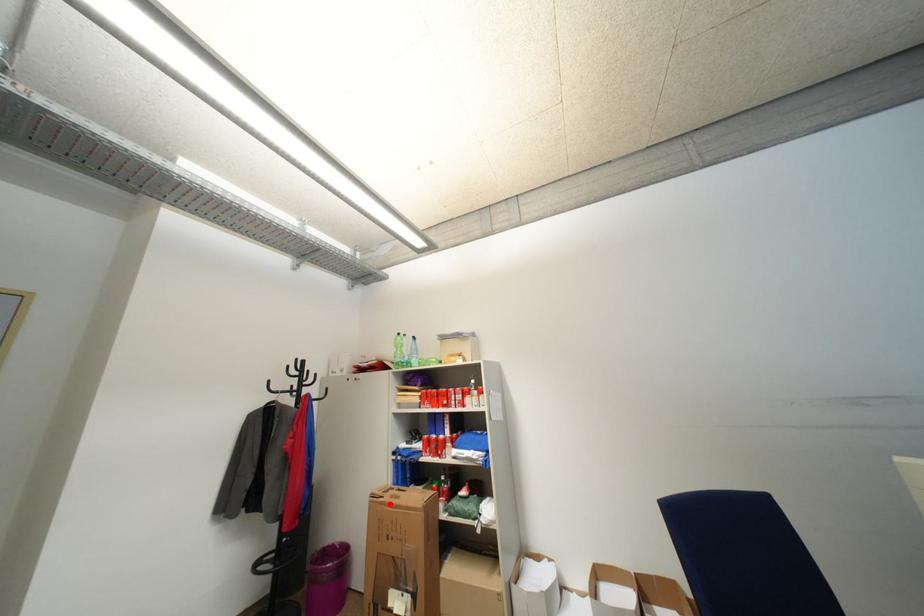
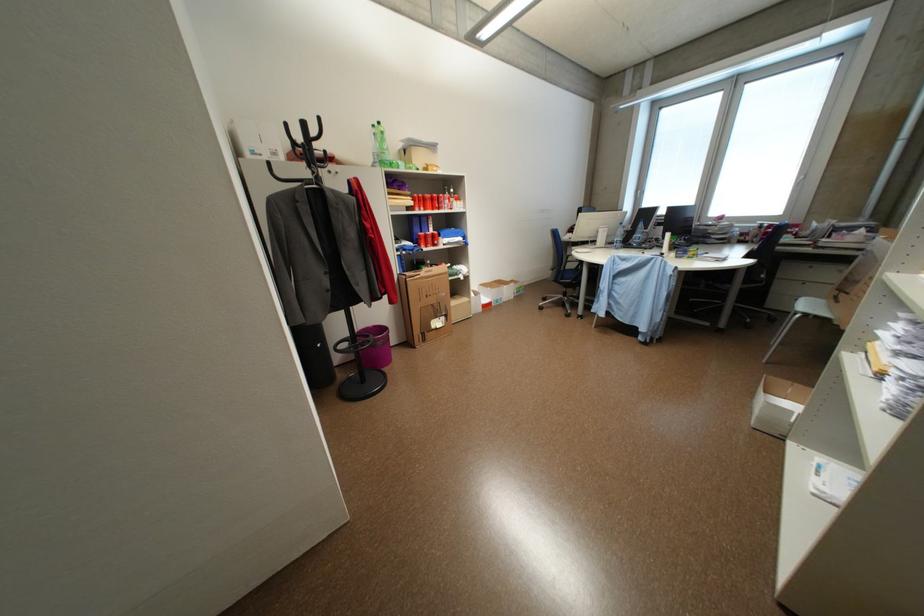
In the second image, find the point that corresponds to the highlighted location in the first image.

(428, 280)